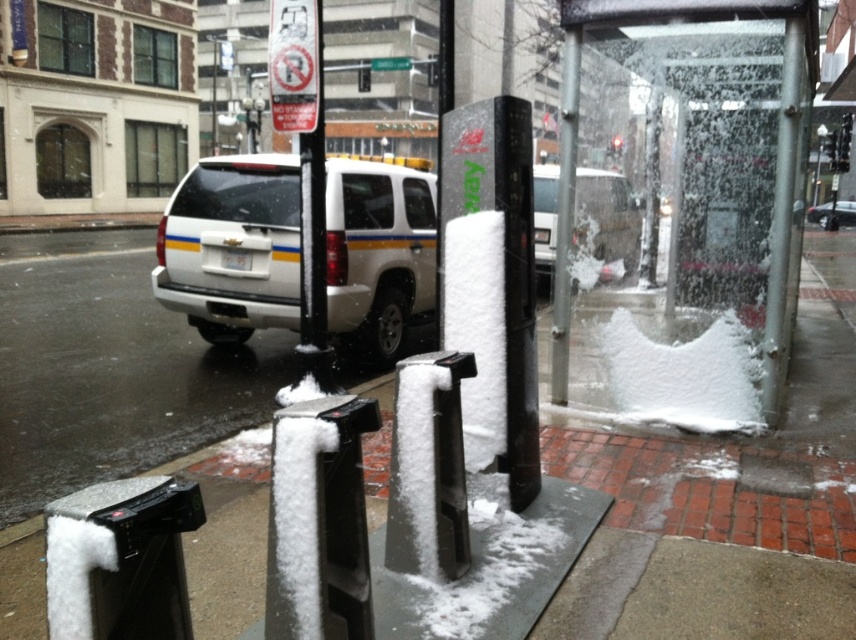
Does white matte police van at center have a lesser height compared to white matte suv at upper center?

No.

Is point (397, 266) positioned in front of point (827, 208)?

Yes, point (397, 266) is closer to viewer.

Is point (215, 196) positioned in front of point (819, 211)?

Yes, point (215, 196) is closer to viewer.

Where is `white matte police van at center`? This screenshot has width=856, height=640. white matte police van at center is located at coordinates (232, 246).

Which is below, transparent glass bus stop at center or white snow at lower left?

white snow at lower left

Does transparent glass bus stop at center have a smaller size compared to white snow at lower left?

Indeed, transparent glass bus stop at center has a smaller size compared to white snow at lower left.

The image size is (856, 640). What do you see at coordinates (687, 204) in the screenshot?
I see `transparent glass bus stop at center` at bounding box center [687, 204].

You are a GUI agent. You are given a task and a screenshot of the screen. Output one action in this format:
    pyautogui.click(x=<x>, y=<y>)
    Task: Click on the transparent glass bus stop at center
    
    Given the screenshot: What is the action you would take?
    pyautogui.click(x=687, y=204)

Is point (557, 394) in front of point (379, 228)?

Yes.

Between point (595, 56) and point (236, 211), which one is positioned behind?

Point (236, 211)

The image size is (856, 640). What are the coordinates of `transparent glass bus stop at center` in the screenshot? It's located at [687, 204].